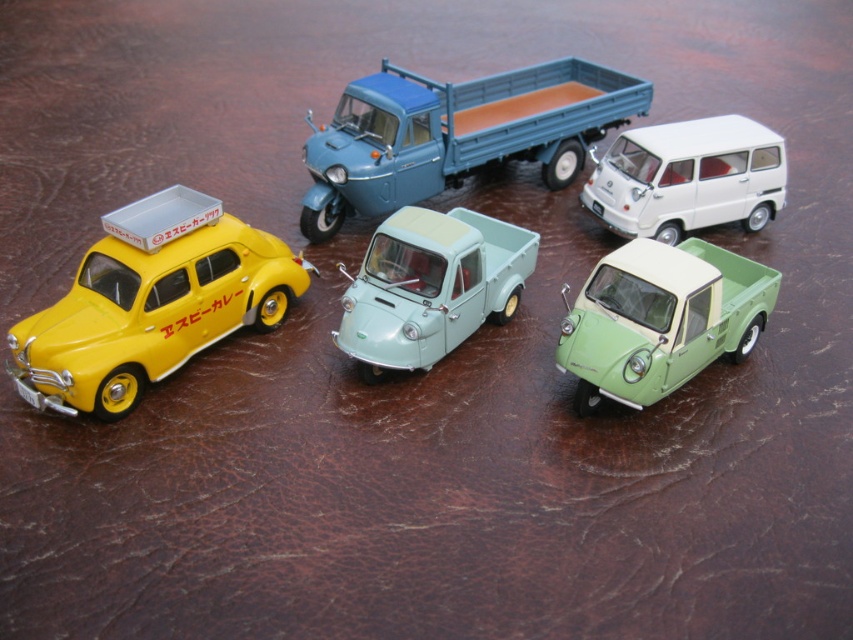
Question: Which object appears closest to the camera in this image?

Choices:
 (A) blue matte truck at upper center
 (B) white matte van at upper right
 (C) light blue matte pickup truck at center

Answer: (C)

Question: Where is blue matte truck at upper center located in relation to green matte pickup truck at center in the image?

Choices:
 (A) above
 (B) below

Answer: (A)

Question: Does matte yellow car at left have a greater width compared to blue matte truck at upper center?

Choices:
 (A) no
 (B) yes

Answer: (A)

Question: Observing the image, what is the correct spatial positioning of matte yellow car at left in reference to blue matte truck at upper center?

Choices:
 (A) below
 (B) above

Answer: (A)

Question: Which object is farther from the camera taking this photo?

Choices:
 (A) light blue matte pickup truck at center
 (B) green matte pickup truck at center
 (C) blue matte truck at upper center
 (D) white matte van at upper right

Answer: (D)

Question: Which of the following is the closest to the observer?

Choices:
 (A) matte yellow car at left
 (B) green matte pickup truck at center

Answer: (A)